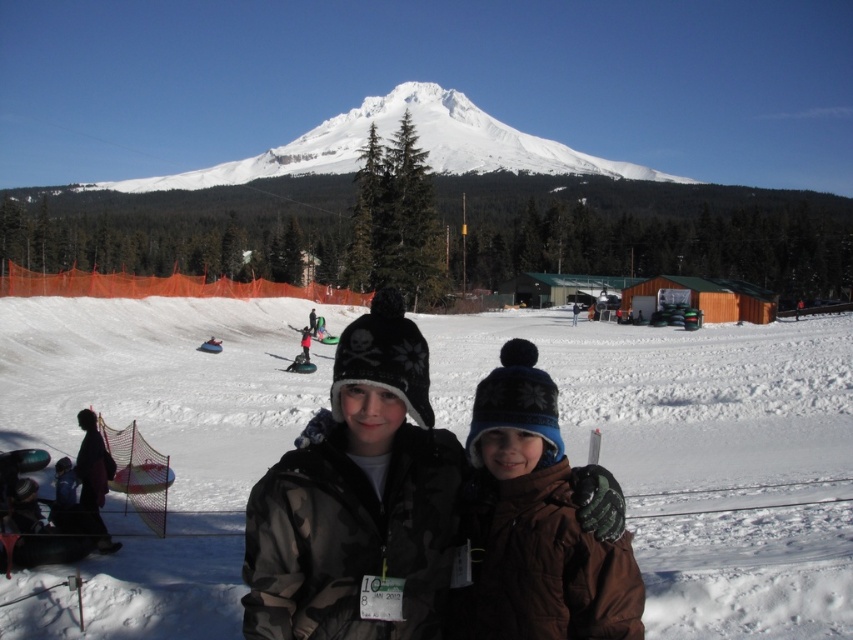
You are a photographer at the winter event. You want to capture a photo of the camouflage jacket at center and the green plastic ski at center. Which object is covering the other one in the image?

The camouflage jacket at center is positioned over green plastic ski at center, so it is covering the green plastic ski at center in the image.